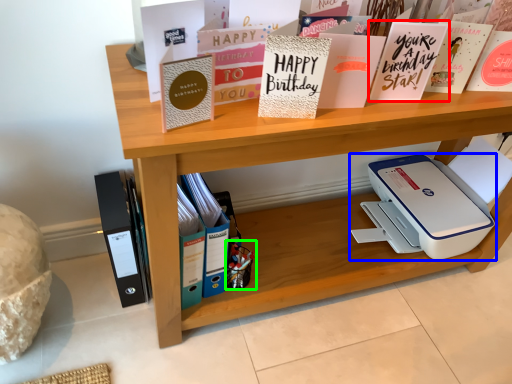
Question: Based on their relative distances, which object is nearer to paperback book (highlighted by a red box)? Choose from printer (highlighted by a blue box) and toy (highlighted by a green box).

Choices:
 (A) printer
 (B) toy

Answer: (A)